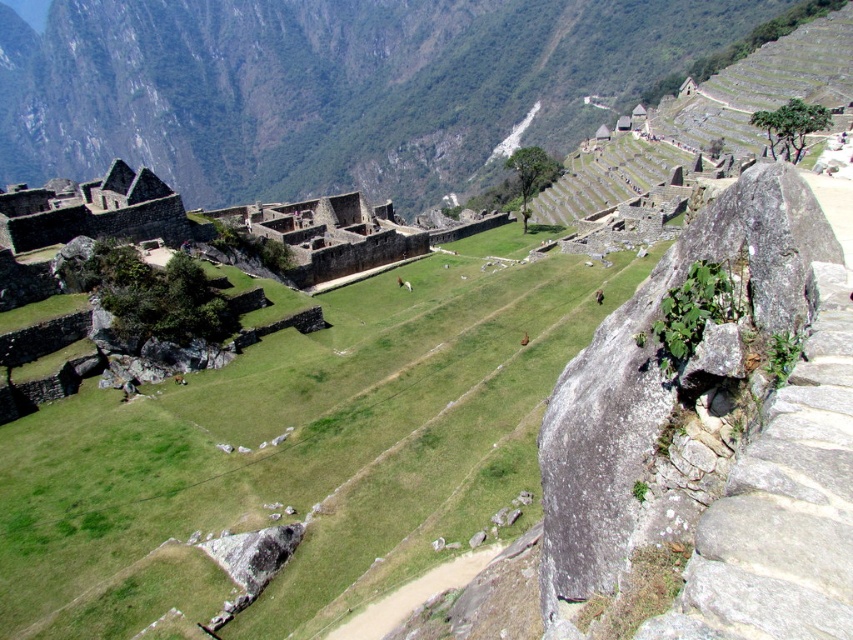
You are standing at the entrance of Machu Picchu and see two points marked in the scene. The first point is at coordinate point (492,317) and the second is at point (442,80). Which point is closer to you?

Point (492,317) is in front of point (442,80), so it is closer to you.

You are a hiker at Machu Picchu and want to take a photo of the grassy areas. Which grassy area should you stand closer to for a better view of the shorter grass? The green grassy at center or the green grassy field at center?

You should stand closer to the green grassy at center because it is shorter than the green grassy field at center, allowing for a clearer view of the shorter grass.

You are a tourist standing at the entrance of Machu Picchu and want to take a photo of the green grassy at center and the green grassy field at center. Which one is located below the other?

The green grassy at center is positioned under the green grassy field at center, meaning the green grassy at center is lower in elevation compared to the green grassy field at center.